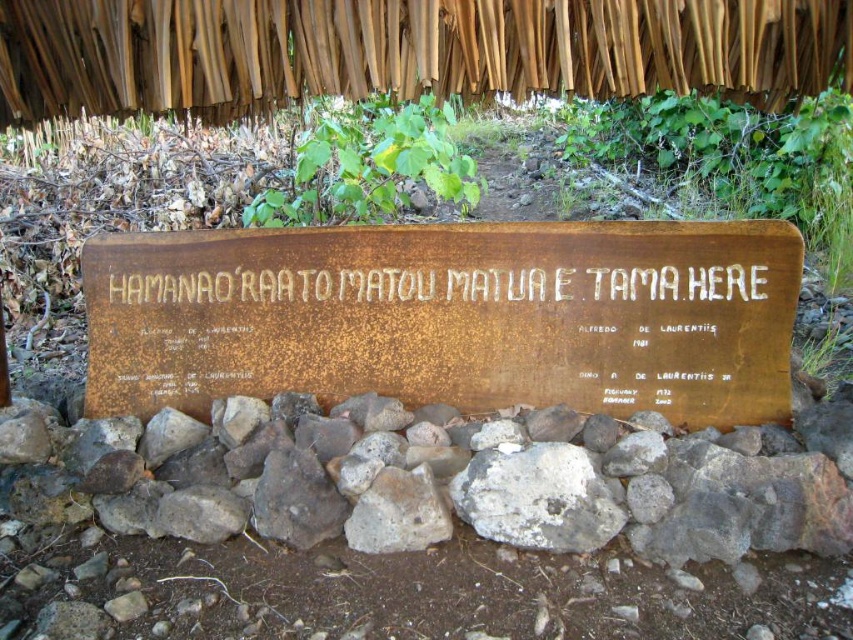
Question: Which object is positioned closest to the rusty metal sign at center?

Choices:
 (A) white textured rock at center
 (B) rusty wood sign at center

Answer: (A)

Question: Does rusty metal sign at center have a smaller size compared to white textured rock at center?

Choices:
 (A) no
 (B) yes

Answer: (A)

Question: Can you confirm if rusty wood sign at center is positioned below rusty metal sign at center?

Choices:
 (A) yes
 (B) no

Answer: (B)

Question: Is rusty metal sign at center below white textured rock at center?

Choices:
 (A) yes
 (B) no

Answer: (B)

Question: Which is farther from the white textured rock at center?

Choices:
 (A) rusty metal sign at center
 (B) rusty wood sign at center

Answer: (B)

Question: Which point is farther from the camera taking this photo?

Choices:
 (A) (521, 506)
 (B) (741, 541)

Answer: (A)